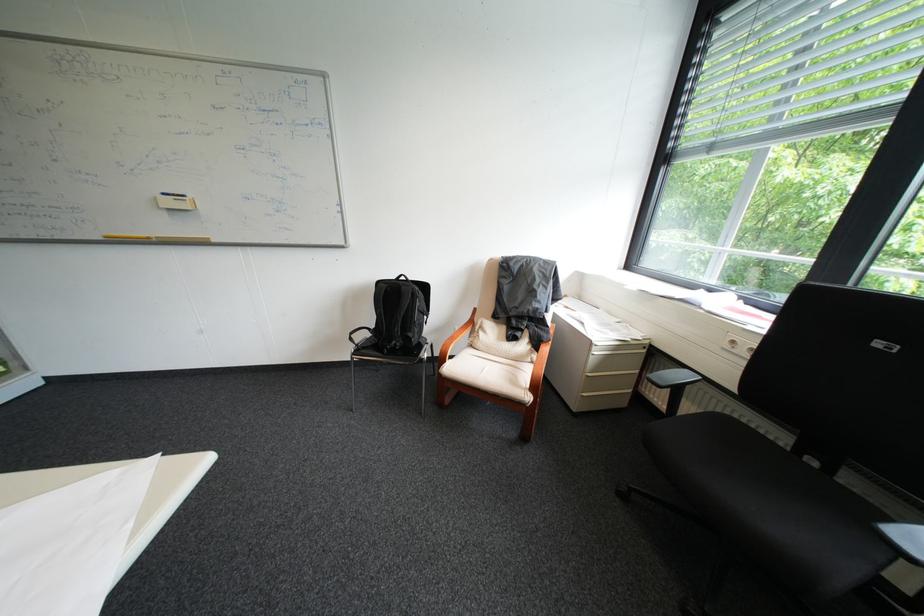
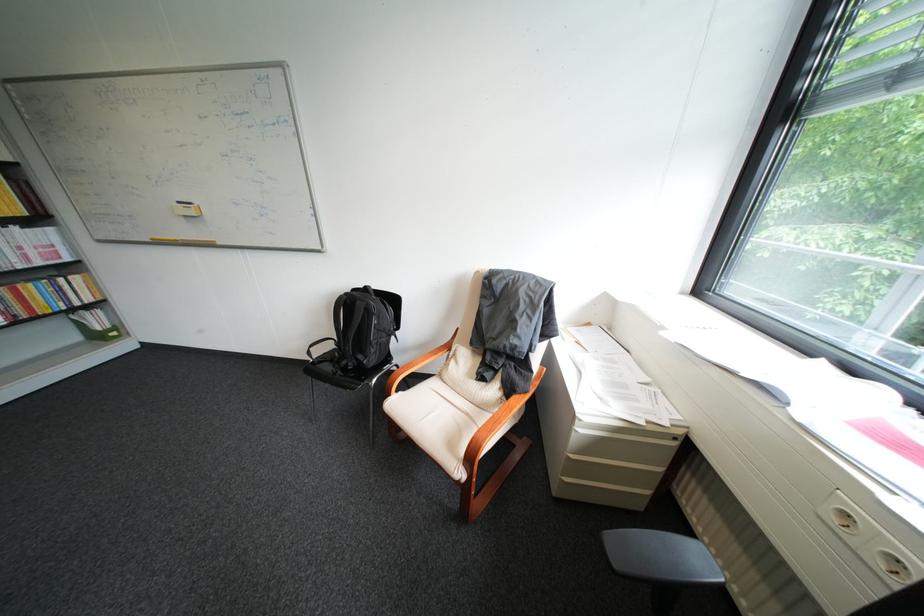
Question: The first image is from the beginning of the video and the second image is from the end. How did the camera likely rotate when shooting the video?

Choices:
 (A) Left
 (B) Right
 (C) Up
 (D) Down

Answer: (A)